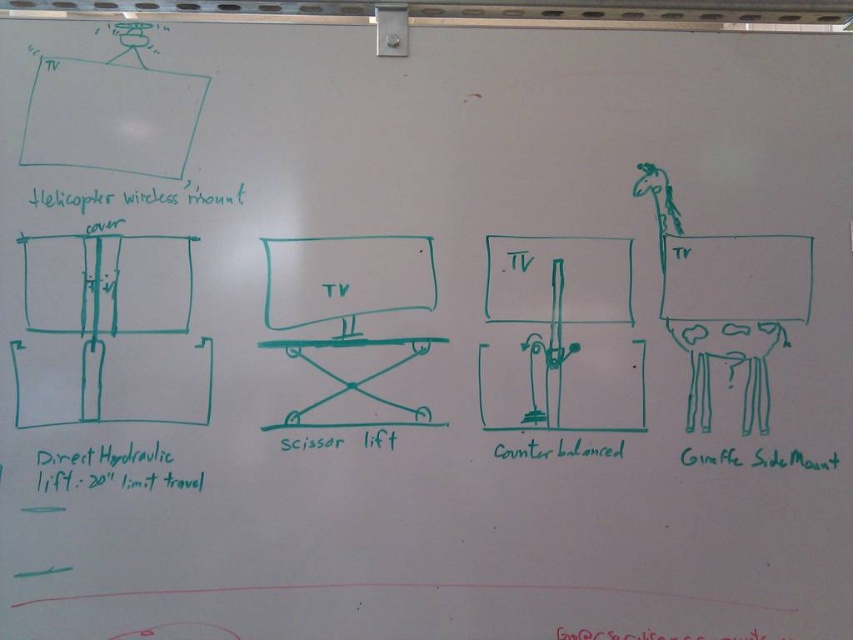
Who is more forward, [126,198] or [572,449]?

Point [126,198] is in front.

Can you confirm if green handwritten text at upper left is taller than counterbalanced at center?

Correct, green handwritten text at upper left is much taller as counterbalanced at center.

Image resolution: width=853 pixels, height=640 pixels. In order to click on green handwritten text at upper left in this screenshot , I will do `click(132, 196)`.

Which is in front, point (149, 204) or point (570, 637)?

Point (149, 204) is more forward.

Based on the photo, who is positioned more to the right, green handwritten text at upper left or red ink writing at lower center?

Positioned to the right is red ink writing at lower center.

The image size is (853, 640). In order to click on green handwritten text at upper left in this screenshot , I will do [132, 196].

The image size is (853, 640). Find the location of `green handwritten text at upper left`. green handwritten text at upper left is located at coordinates (132, 196).

Is direct hydraulic lift at lower left closer to camera compared to green matte giraffe side mount at right?

Yes, it is in front of green matte giraffe side mount at right.

Identify the location of direct hydraulic lift at lower left. (111, 468).

Which is behind, point (74, 452) or point (727, 449)?

The point (727, 449) is more distant.

Locate an element on the screen. Image resolution: width=853 pixels, height=640 pixels. direct hydraulic lift at lower left is located at coordinates [111, 468].